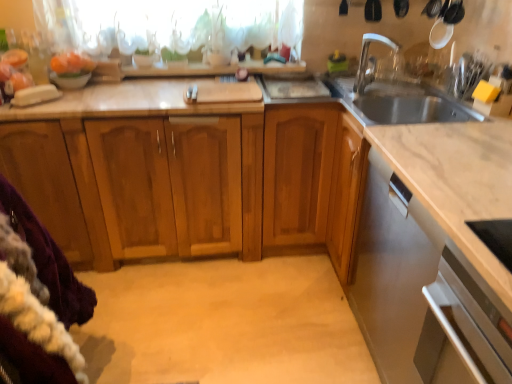
Identify the location of free space above wooden cabinets at center (from a real-world perspective). The image size is (512, 384). (134, 94).